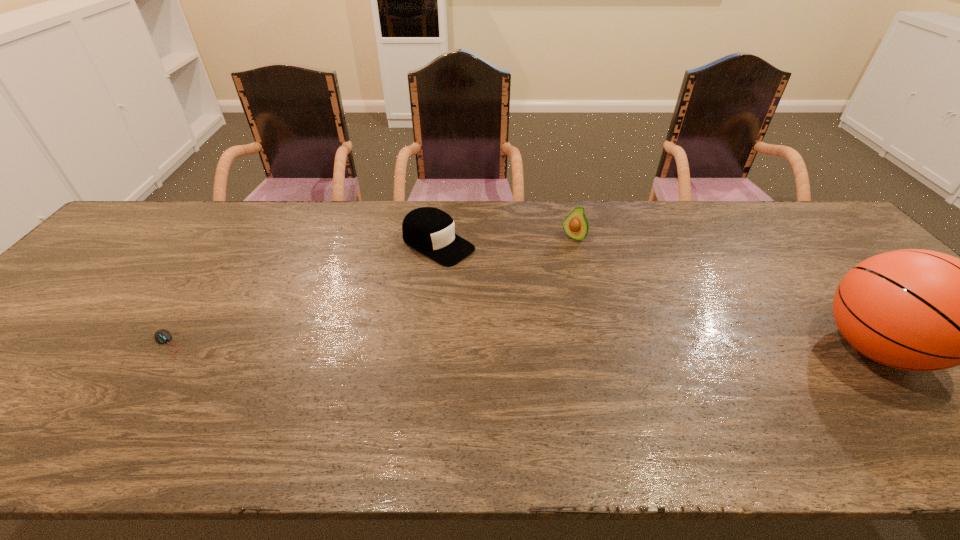
Find the location of `vacant space on the desktop that is between the leftmost object and the basketball and is positioned on the cut side of the third shortest object`. vacant space on the desktop that is between the leftmost object and the basketball and is positioned on the cut side of the third shortest object is located at coordinates (482, 346).

At what (x,y) coordinates should I click in order to perform the action: click on free space on the desktop that is between the shortest object and the basketball and is positioned on the front-facing side of the cap. Please return your answer as a coordinate pair (x, y). Looking at the image, I should click on (621, 347).